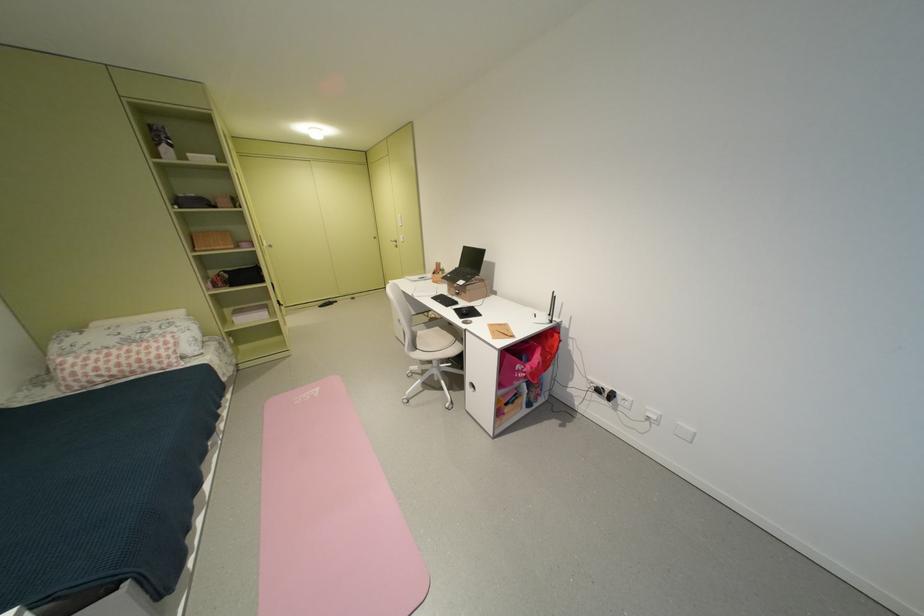
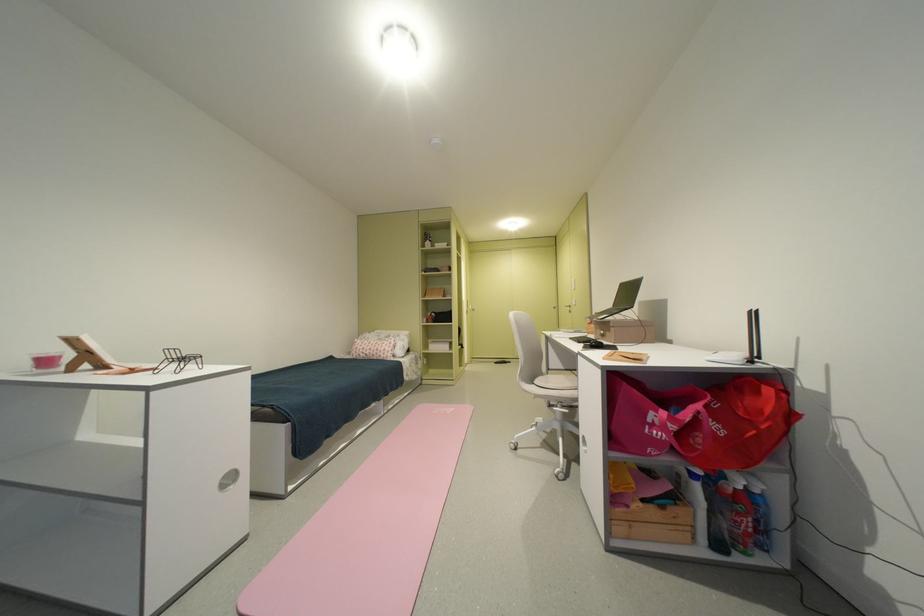
Where in the second image is the point corresponding to [428,349] from the first image?

(543, 383)